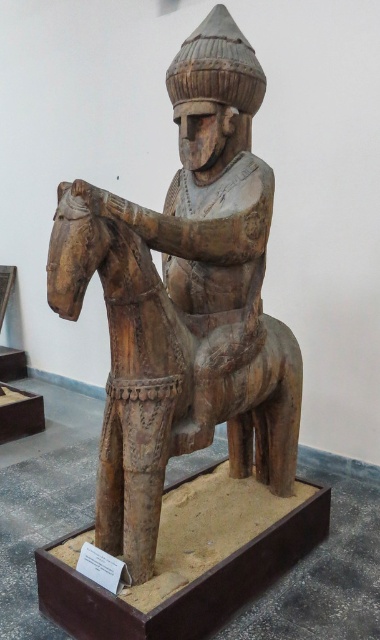
Question: Which point is closer to the camera?

Choices:
 (A) (104, 499)
 (B) (272, 196)

Answer: (A)

Question: Is wooden horse at center to the left of wooden statue at center from the viewer's perspective?

Choices:
 (A) no
 (B) yes

Answer: (A)

Question: Among these points, which one is farthest from the camera?

Choices:
 (A) (110, 282)
 (B) (188, 72)

Answer: (B)

Question: Where is wooden horse at center located in relation to wooden statue at center in the image?

Choices:
 (A) above
 (B) below

Answer: (B)

Question: Which of the following is the closest to the observer?

Choices:
 (A) wooden statue at center
 (B) wooden horse at center

Answer: (A)

Question: Is wooden horse at center positioned at the back of wooden statue at center?

Choices:
 (A) yes
 (B) no

Answer: (A)